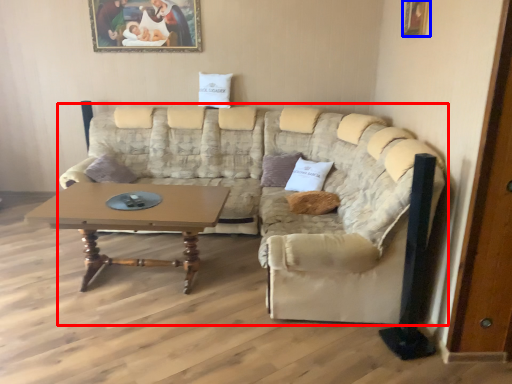
Question: Which object is further to the camera taking this photo, studio couch (highlighted by a red box) or picture frame (highlighted by a blue box)?

Choices:
 (A) studio couch
 (B) picture frame

Answer: (B)